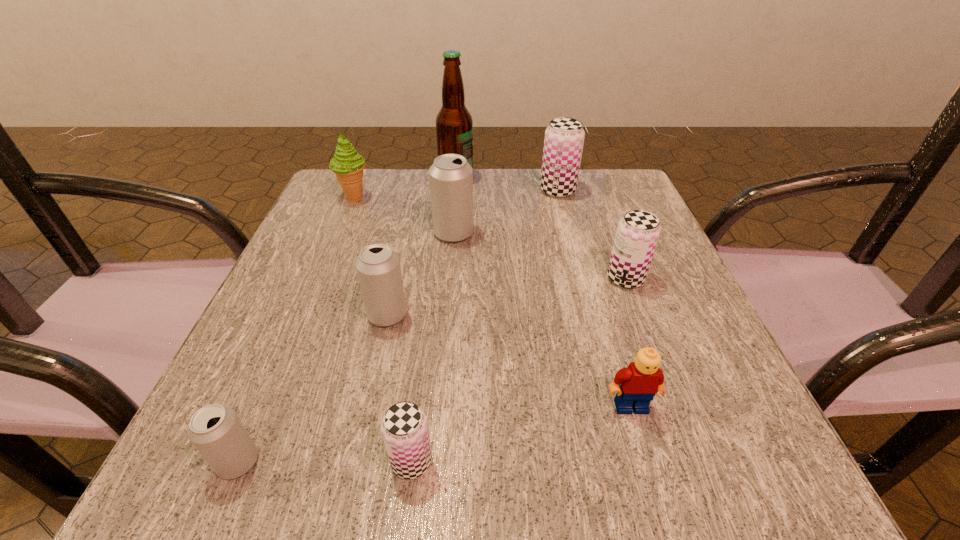
You are a GUI agent. You are given a task and a screenshot of the screen. Output one action in this format:
    pyautogui.click(x=<x>, y=<y>)
    Task: Click on the tallest object
    This screenshot has height=540, width=960.
    Given the screenshot: What is the action you would take?
    pyautogui.click(x=454, y=125)

This screenshot has width=960, height=540. I want to click on beer bottle, so click(x=454, y=125).

Identify the location of the second purple beer can from right to left. (563, 144).

Identify the location of the biggest purple beer can. (563, 144).

You are a GUI agent. You are given a task and a screenshot of the screen. Output one action in this format:
    pyautogui.click(x=<x>, y=<y>)
    Task: Click on the rightmost white beer can
    Image resolution: width=960 pixels, height=540 pixels.
    Given the screenshot: What is the action you would take?
    pyautogui.click(x=451, y=177)

You are a GUI agent. You are given a task and a screenshot of the screen. Output one action in this format:
    pyautogui.click(x=<x>, y=<y>)
    Task: Click on the second farthest beer can
    This screenshot has width=960, height=540.
    Given the screenshot: What is the action you would take?
    pyautogui.click(x=451, y=177)

This screenshot has width=960, height=540. Find the location of `icecream`. icecream is located at coordinates (347, 164).

Where is `the rightmost purple beer can`? Image resolution: width=960 pixels, height=540 pixels. the rightmost purple beer can is located at coordinates (638, 231).

At what (x,y) coordinates should I click in order to perform the action: click on the second biggest purple beer can. Please return your answer as a coordinate pair (x, y). The height and width of the screenshot is (540, 960). Looking at the image, I should click on (638, 231).

Identify the location of the third nearest beer can. (378, 269).